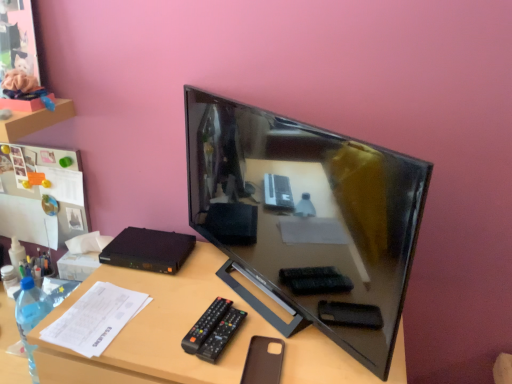
Identify the location of empty space that is to the right of brown leather phone case at lower center. (314, 357).